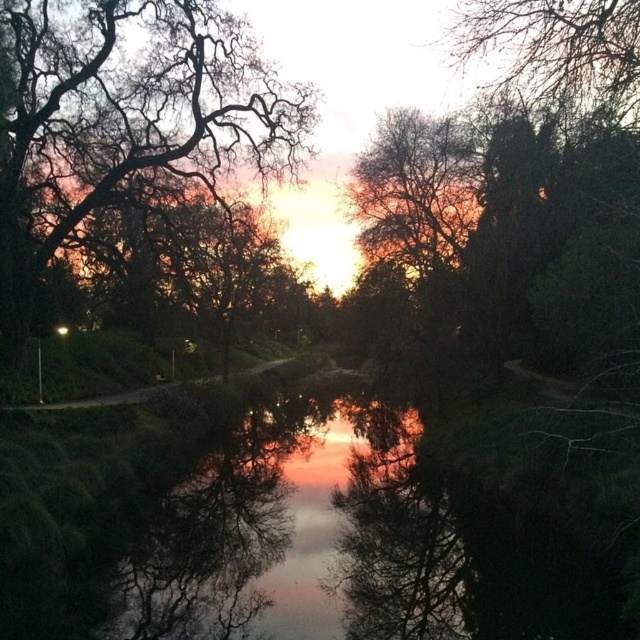
Does silhouette bare branches at upper left have a lesser height compared to bare branches at upper center?

No, silhouette bare branches at upper left is not shorter than bare branches at upper center.

Consider the image. Is silhouette bare branches at upper left to the right of bare branches at upper center from the viewer's perspective?

In fact, silhouette bare branches at upper left is to the left of bare branches at upper center.

This screenshot has height=640, width=640. Describe the element at coordinates (124, 120) in the screenshot. I see `silhouette bare branches at upper left` at that location.

Find the location of a particular element. This screenshot has width=640, height=640. silhouette bare branches at upper left is located at coordinates (124, 120).